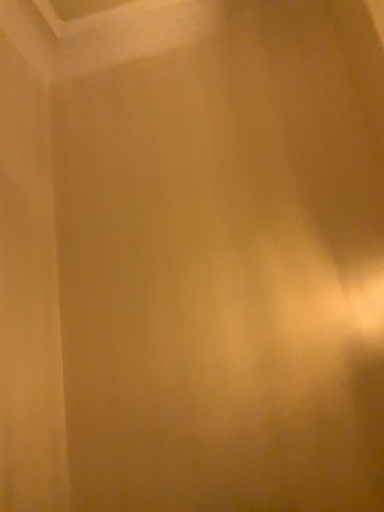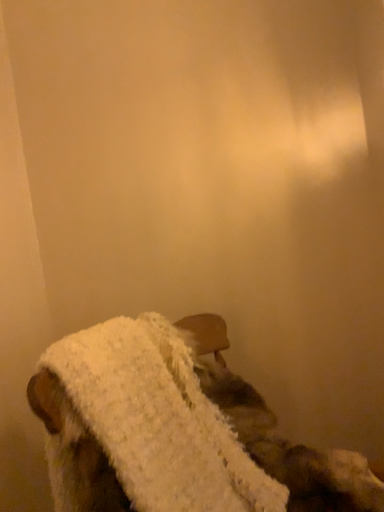
Question: How did the camera likely rotate when shooting the video?

Choices:
 (A) rotated downward
 (B) rotated upward

Answer: (A)